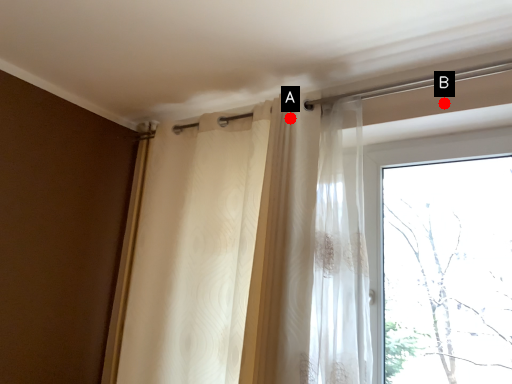
Question: Two points are circled on the image, labeled by A and B beside each circle. Which point is farther to the camera?

Choices:
 (A) A is further
 (B) B is further

Answer: (A)